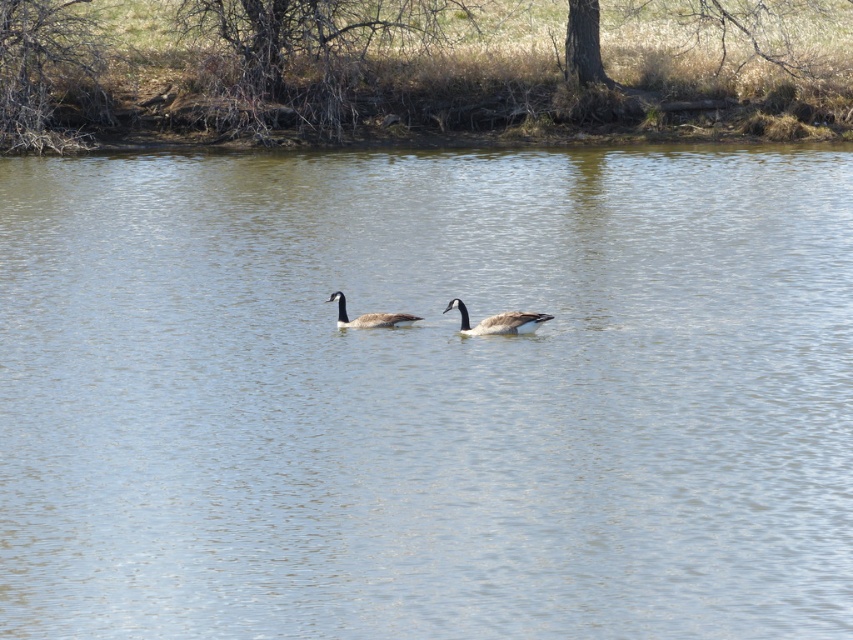
Is point (524, 324) farther from viewer compared to point (360, 317)?

No.

Can you confirm if brown speckled duck at center is positioned to the right of brown feathered duck at center?

Yes, brown speckled duck at center is to the right of brown feathered duck at center.

Is point (515, 312) positioned after point (337, 301)?

No, it is not.

The width and height of the screenshot is (853, 640). I want to click on brown speckled duck at center, so click(498, 321).